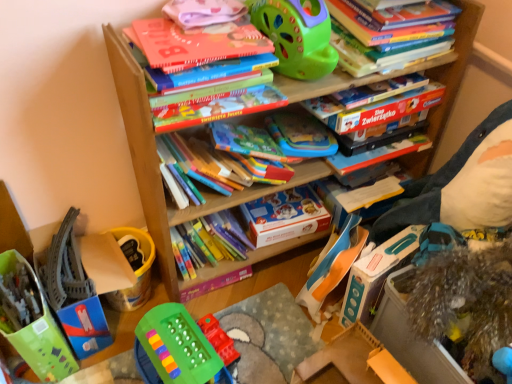
Where is `free spot above multicolored plastic crayons at center, the 4th book viewed from the top (from a real-world perspective)`? The image size is (512, 384). free spot above multicolored plastic crayons at center, the 4th book viewed from the top (from a real-world perspective) is located at coordinates (251, 145).